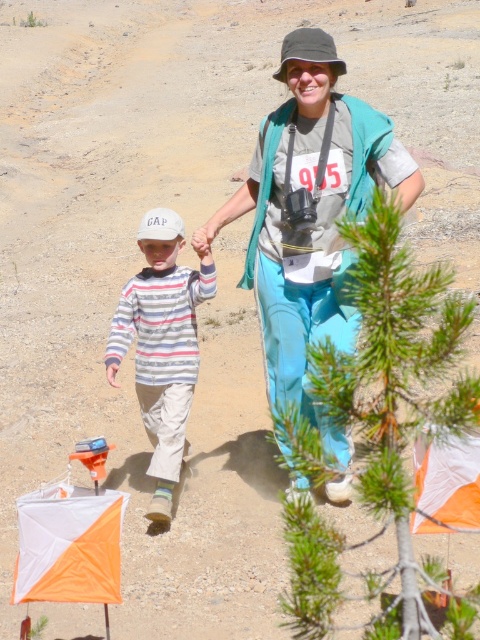
Which is more to the left, striped cotton shirt at center or orange fabric kite at lower right?

From the viewer's perspective, striped cotton shirt at center appears more on the left side.

Between point (164, 314) and point (432, 445), which one is positioned in front?

Point (432, 445) is in front.

This screenshot has width=480, height=640. Identify the location of striped cotton shirt at center. (162, 344).

Which is above, orange fabric kite at lower left or orange fabric kite at lower right?

Positioned higher is orange fabric kite at lower right.

Can you confirm if orange fabric kite at lower left is positioned to the right of orange fabric kite at lower right?

No, orange fabric kite at lower left is not to the right of orange fabric kite at lower right.

Is point (107, 531) less distant than point (432, 477)?

Yes, point (107, 531) is closer to viewer.

Locate an element on the screen. The image size is (480, 640). orange fabric kite at lower left is located at coordinates (72, 538).

Does point (200, 273) lie in front of point (108, 637)?

That is False.

Looking at this image, is striped cotton shirt at center to the left of orange fabric kite at lower left from the viewer's perspective?

In fact, striped cotton shirt at center is to the right of orange fabric kite at lower left.

Identify the location of striped cotton shirt at center. The width and height of the screenshot is (480, 640). (162, 344).